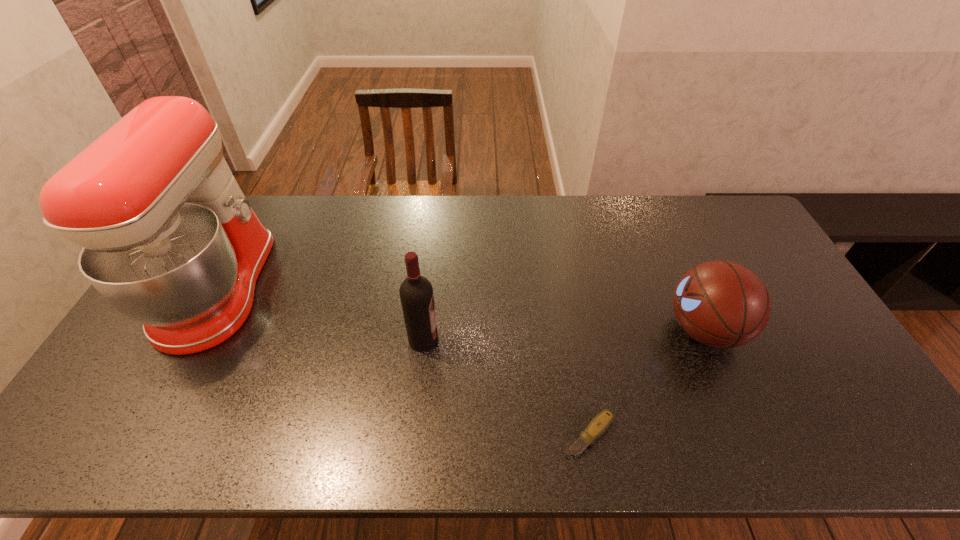
This screenshot has height=540, width=960. Find the location of `empty space that is in between the leftmost object and the third object from right to left`. empty space that is in between the leftmost object and the third object from right to left is located at coordinates (321, 314).

The width and height of the screenshot is (960, 540). I want to click on unoccupied area between the leftmost object and the second shortest object, so click(x=461, y=309).

Find the location of a particular element. empty space that is in between the rightmost object and the wine bottle is located at coordinates (564, 335).

This screenshot has height=540, width=960. Find the location of `vacant area between the nearest object and the third shortest object`. vacant area between the nearest object and the third shortest object is located at coordinates (506, 387).

What are the coordinates of `vacant space in between the pocketknife and the tallest object` in the screenshot? It's located at (403, 361).

Locate an element on the screen. The image size is (960, 540). unoccupied position between the shortest object and the tallest object is located at coordinates (403, 361).

What are the coordinates of `vacant region between the pocketknife and the mixer` in the screenshot? It's located at (403, 361).

I want to click on vacant area between the tallest object and the nearest object, so click(x=403, y=361).

At what (x,y) coordinates should I click in order to perform the action: click on free spot between the pocketknife and the leftmost object. Please return your answer as a coordinate pair (x, y). Looking at the image, I should click on (403, 361).

Identify which object is the nearest to the basketball. Please provide its 2D coordinates. Your answer should be formatted as a tuple, i.e. [(x, y)], where the tuple contains the x and y coordinates of a point satisfying the conditions above.

[(600, 423)]